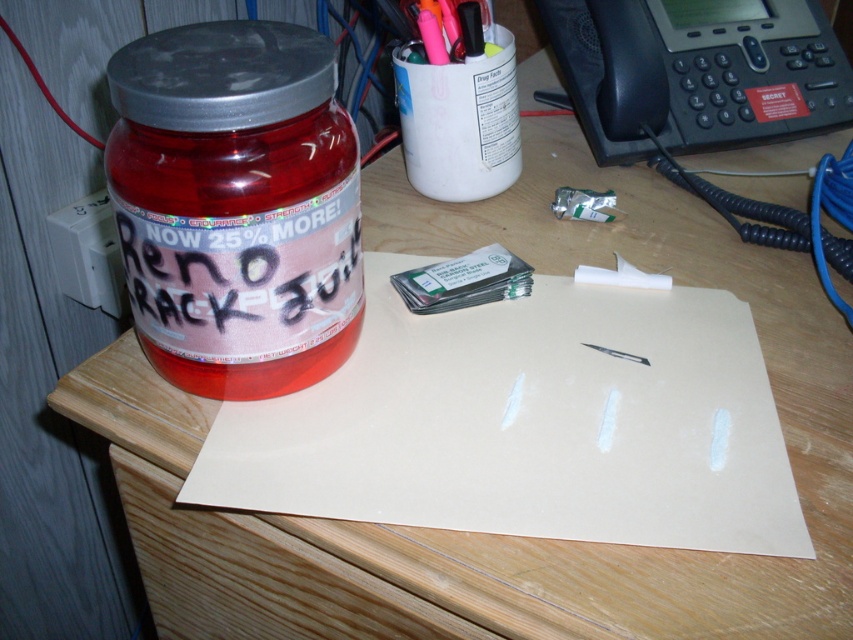
Looking at this image, you are organizing a first aid kit and need to place the translucent plastic jar at left and the matte pink plastic jar at left into a drawer. Which jar should you place first to ensure they both fit without overlapping?

The translucent plastic jar at left is larger in size than the matte pink plastic jar at left, so you should place the larger jar first to accommodate both in the drawer without overlapping.

You need to place a rectangular box that is 10 cm wide on the desk. Given the white matte paper at center and the matte pink plastic jar at left, which object can the box fit next to without overlapping?

The white matte paper at center has a larger width than the matte pink plastic jar at left, so the box can fit next to the white matte paper at center since it provides more space.